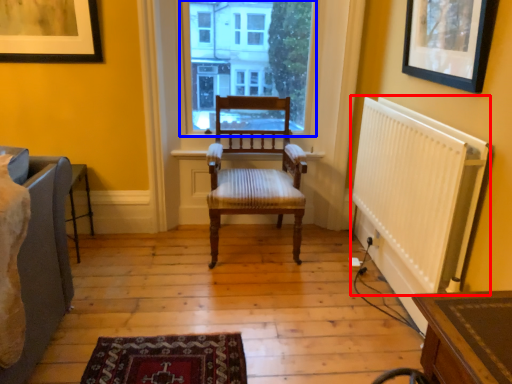
Question: Which of the following is the farthest to the observer, radiator (highlighted by a red box) or window (highlighted by a blue box)?

Choices:
 (A) radiator
 (B) window

Answer: (B)